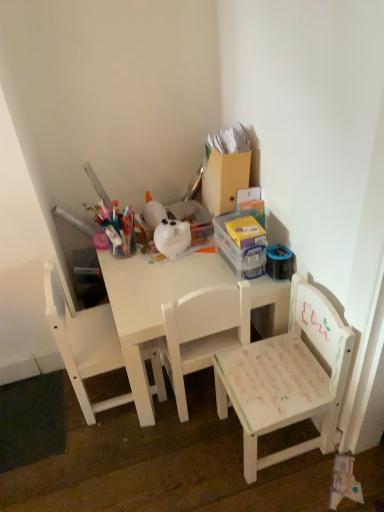
Question: Can we say white painted wood chair at center, placed as the second chair when sorted from left to right, lies outside white painted wood chair at lower right, which appears as the 3th chair when viewed from the left?

Choices:
 (A) yes
 (B) no

Answer: (A)

Question: Is white painted wood chair at center, marked as the 2th chair in a right-to-left arrangement, next to white painted wood chair at lower right, the first chair from the right, and touching it?

Choices:
 (A) no
 (B) yes

Answer: (A)

Question: From the image's perspective, does white painted wood chair at center, placed as the second chair when sorted from left to right, appear higher than white painted wood chair at lower right, which appears as the 3th chair when viewed from the left?

Choices:
 (A) no
 (B) yes

Answer: (B)

Question: Is white painted wood chair at center, marked as the 2th chair in a right-to-left arrangement, smaller than white painted wood chair at lower right, which appears as the 3th chair when viewed from the left?

Choices:
 (A) no
 (B) yes

Answer: (B)

Question: From a real-world perspective, is white painted wood chair at center, placed as the second chair when sorted from left to right, positioned under white painted wood chair at lower right, the first chair from the right, based on gravity?

Choices:
 (A) yes
 (B) no

Answer: (B)

Question: From a real-world perspective, is white matte chair at center, which ranks as the third chair in right-to-left order, positioned above or below white painted wood chair at center, marked as the 2th chair in a right-to-left arrangement?

Choices:
 (A) below
 (B) above

Answer: (B)

Question: Is white matte chair at center, the first chair from the left, in front of or behind white painted wood chair at center, placed as the second chair when sorted from left to right, in the image?

Choices:
 (A) behind
 (B) front

Answer: (A)

Question: In terms of width, does white matte chair at center, which ranks as the third chair in right-to-left order, look wider or thinner when compared to white painted wood chair at center, placed as the second chair when sorted from left to right?

Choices:
 (A) thin
 (B) wide

Answer: (B)

Question: Is white matte chair at center, which ranks as the third chair in right-to-left order, taller or shorter than white painted wood chair at center, placed as the second chair when sorted from left to right?

Choices:
 (A) tall
 (B) short

Answer: (B)

Question: Relative to white painted wood chair at lower right, which appears as the 3th chair when viewed from the left, is white painted wood chair at center, placed as the second chair when sorted from left to right, in front or behind?

Choices:
 (A) behind
 (B) front

Answer: (A)

Question: Would you say white painted wood chair at center, placed as the second chair when sorted from left to right, is inside or outside white painted wood chair at lower right, which appears as the 3th chair when viewed from the left?

Choices:
 (A) outside
 (B) inside

Answer: (A)

Question: Is white painted wood chair at center, placed as the second chair when sorted from left to right, bigger or smaller than white painted wood chair at lower right, which appears as the 3th chair when viewed from the left?

Choices:
 (A) small
 (B) big

Answer: (A)

Question: Is white painted wood chair at center, marked as the 2th chair in a right-to-left arrangement, taller or shorter than white painted wood chair at lower right, the first chair from the right?

Choices:
 (A) short
 (B) tall

Answer: (B)

Question: Considering the positions of white painted wood chair at center, placed as the second chair when sorted from left to right, and white matte chair at center, which ranks as the third chair in right-to-left order, in the image, is white painted wood chair at center, placed as the second chair when sorted from left to right, wider or thinner than white matte chair at center, which ranks as the third chair in right-to-left order,?

Choices:
 (A) thin
 (B) wide

Answer: (A)

Question: From a real-world perspective, is white painted wood chair at center, marked as the 2th chair in a right-to-left arrangement, physically located above or below white matte chair at center, which ranks as the third chair in right-to-left order?

Choices:
 (A) below
 (B) above

Answer: (A)